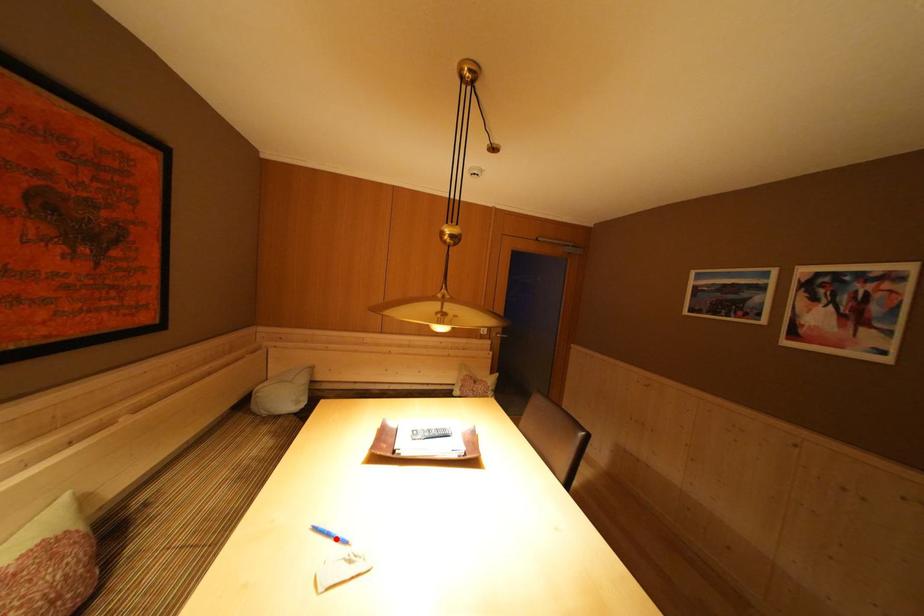
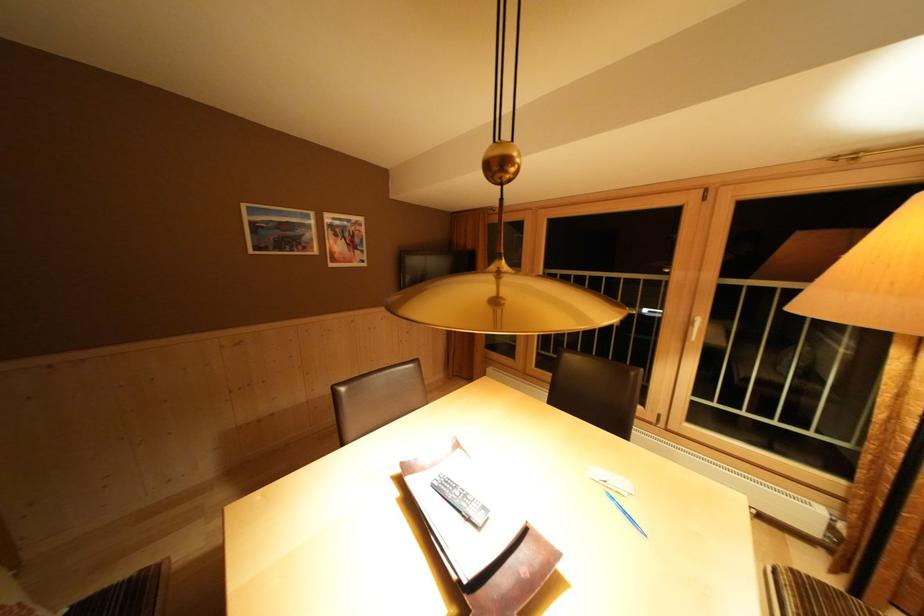
Where in the second image is the point corresponding to the highlighted location from the first image?

(633, 517)